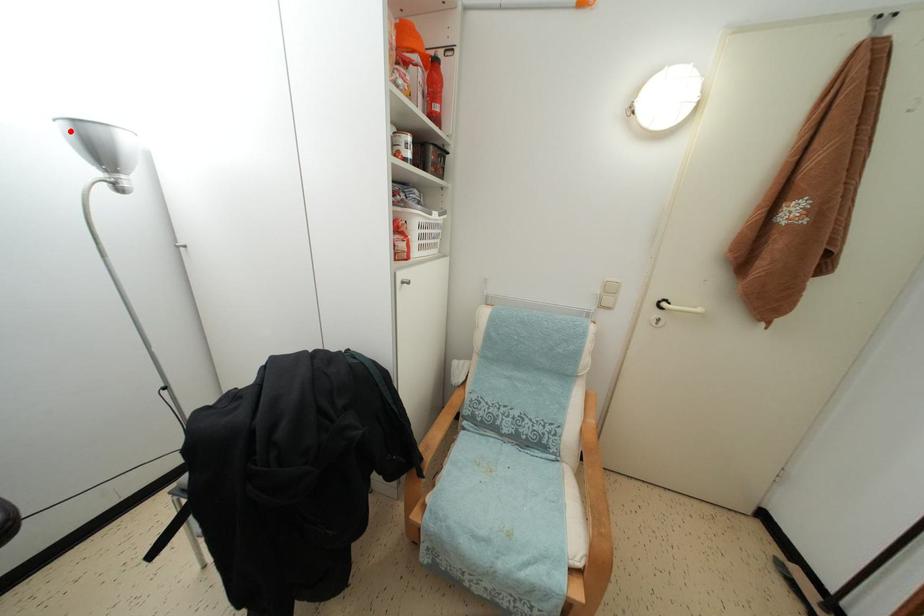
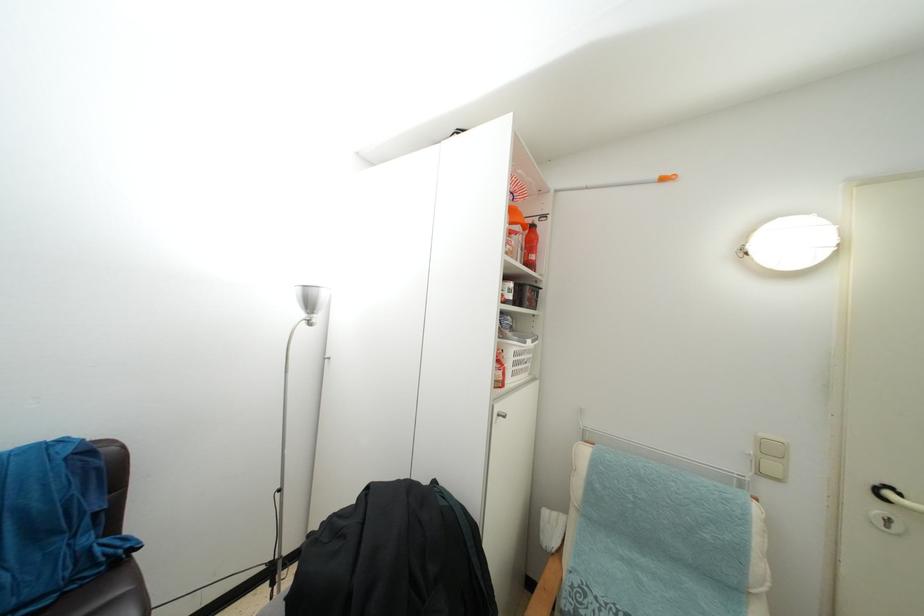
Where in the second image is the point corresponding to the highlighted location from the first image?

(304, 294)